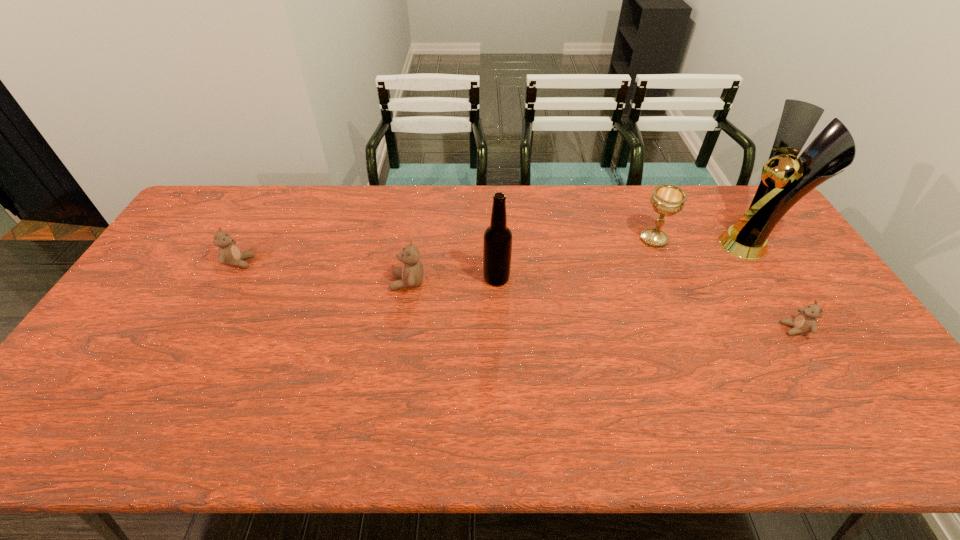
The width and height of the screenshot is (960, 540). In order to click on blank space at the far left corner of the desktop in this screenshot , I will do point(191,220).

Locate an element on the screen. The image size is (960, 540). empty space between the shortest teddy bear and the third tallest object is located at coordinates (724, 284).

Where is `vacant space that's between the fourth object from left to right and the rightmost teddy bear`? vacant space that's between the fourth object from left to right and the rightmost teddy bear is located at coordinates (724, 284).

In order to click on free spot between the award and the chalice in this screenshot , I will do `click(703, 241)`.

The width and height of the screenshot is (960, 540). What are the coordinates of `empty space between the rightmost teddy bear and the award` in the screenshot? It's located at (773, 286).

This screenshot has width=960, height=540. What are the coordinates of `vacant space in between the second tallest object and the third object from right to left` in the screenshot? It's located at (575, 259).

This screenshot has height=540, width=960. What are the coordinates of `free space between the tallest object and the beer bottle` in the screenshot? It's located at click(x=624, y=261).

This screenshot has height=540, width=960. Identify the location of vacant space that's between the rightmost teddy bear and the tallest object. (773, 286).

What are the coordinates of `empty location between the fourth object from right to left and the second teddy bear from right to left` in the screenshot? It's located at (452, 280).

Locate an element on the screen. unoccupied position between the tallest object and the fourth object from right to left is located at coordinates (624, 261).